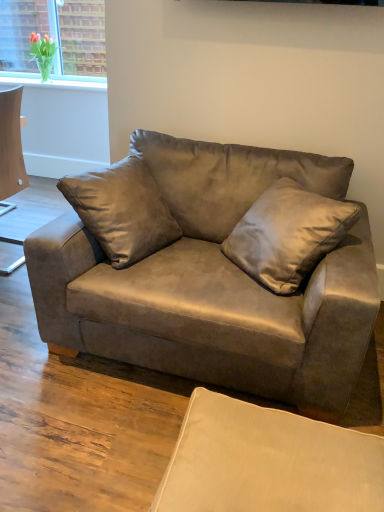
Question: Could you tell me if beige fabric swivel chair at lower right is turned towards suede couch at center?

Choices:
 (A) no
 (B) yes

Answer: (A)

Question: From the image's perspective, is beige fabric swivel chair at lower right above suede couch at center?

Choices:
 (A) no
 (B) yes

Answer: (A)

Question: Is beige fabric swivel chair at lower right to the left of suede couch at center from the viewer's perspective?

Choices:
 (A) yes
 (B) no

Answer: (B)

Question: Is beige fabric swivel chair at lower right further to camera compared to suede couch at center?

Choices:
 (A) yes
 (B) no

Answer: (B)

Question: Is the surface of beige fabric swivel chair at lower right in direct contact with suede couch at center?

Choices:
 (A) yes
 (B) no

Answer: (B)

Question: Based on their positions, is satin brown pillow at center located to the left or right of beige fabric swivel chair at lower right?

Choices:
 (A) right
 (B) left

Answer: (A)

Question: Considering the positions of satin brown pillow at center and beige fabric swivel chair at lower right in the image, is satin brown pillow at center bigger or smaller than beige fabric swivel chair at lower right?

Choices:
 (A) big
 (B) small

Answer: (A)

Question: In terms of width, does satin brown pillow at center look wider or thinner when compared to beige fabric swivel chair at lower right?

Choices:
 (A) thin
 (B) wide

Answer: (A)

Question: From the image's perspective, relative to beige fabric swivel chair at lower right, is satin brown pillow at center above or below?

Choices:
 (A) below
 (B) above

Answer: (B)

Question: Considering the positions of suede couch at center and beige fabric swivel chair at lower right in the image, is suede couch at center taller or shorter than beige fabric swivel chair at lower right?

Choices:
 (A) tall
 (B) short

Answer: (A)

Question: Do you think suede couch at center is within beige fabric swivel chair at lower right, or outside of it?

Choices:
 (A) inside
 (B) outside

Answer: (B)

Question: Considering the positions of point (196, 237) and point (299, 472), is point (196, 237) closer or farther from the camera than point (299, 472)?

Choices:
 (A) closer
 (B) farther

Answer: (B)

Question: Considering the positions of suede couch at center and beige fabric swivel chair at lower right in the image, is suede couch at center wider or thinner than beige fabric swivel chair at lower right?

Choices:
 (A) thin
 (B) wide

Answer: (B)

Question: In the image, is satin brown pillow at center positioned in front of or behind suede couch at center?

Choices:
 (A) front
 (B) behind

Answer: (B)

Question: Considering the positions of satin brown pillow at center and suede couch at center in the image, is satin brown pillow at center bigger or smaller than suede couch at center?

Choices:
 (A) small
 (B) big

Answer: (A)